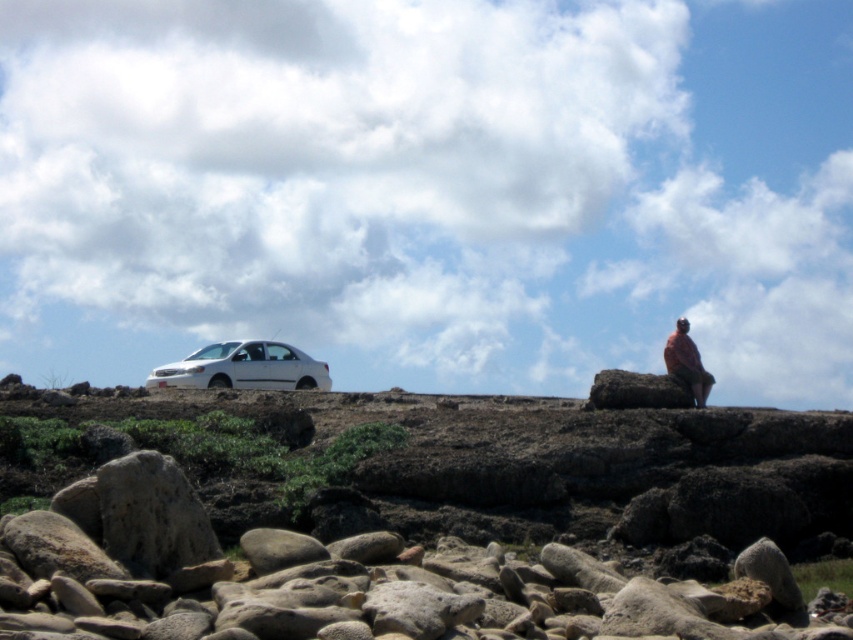
Is white matte car at upper left wider than pink fabric at upper right?

Indeed, white matte car at upper left has a greater width compared to pink fabric at upper right.

Does white matte car at upper left come in front of pink fabric at upper right?

That is True.

Who is more distant from viewer, (x=138, y=584) or (x=700, y=376)?

The point (x=700, y=376) is behind.

You are a GUI agent. You are given a task and a screenshot of the screen. Output one action in this format:
    pyautogui.click(x=<x>, y=<y>)
    Task: Click on the white matte car at upper left
    The image size is (853, 640).
    Given the screenshot: What is the action you would take?
    pyautogui.click(x=421, y=518)

Is point (172, 518) positioned in front of point (320, 365)?

Yes.

Can you confirm if white matte car at upper left is bigger than white matte sedan at left?

Yes, white matte car at upper left is bigger than white matte sedan at left.

Who is more distant from viewer, (265,628) or (181,364)?

Point (181,364)

Locate an element on the screen. This screenshot has width=853, height=640. white matte car at upper left is located at coordinates (421, 518).

Is white matte sedan at left below pink fabric at upper right?

Yes.

Can you confirm if white matte sedan at left is shorter than pink fabric at upper right?

Correct, white matte sedan at left is not as tall as pink fabric at upper right.

The image size is (853, 640). Identify the location of white matte sedan at left. (242, 369).